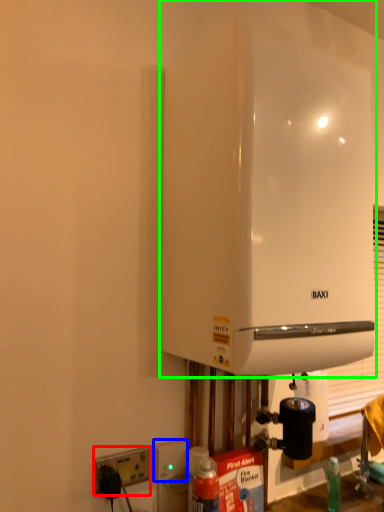
Question: Which object is positioned closest to electric outlet (highlighted by a red box)? Select from electric outlet (highlighted by a blue box) and home appliance (highlighted by a green box).

Choices:
 (A) electric outlet
 (B) home appliance

Answer: (A)